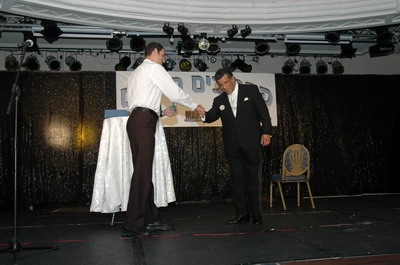
Identify the location of white linen blanket. This screenshot has width=400, height=265. (111, 164).